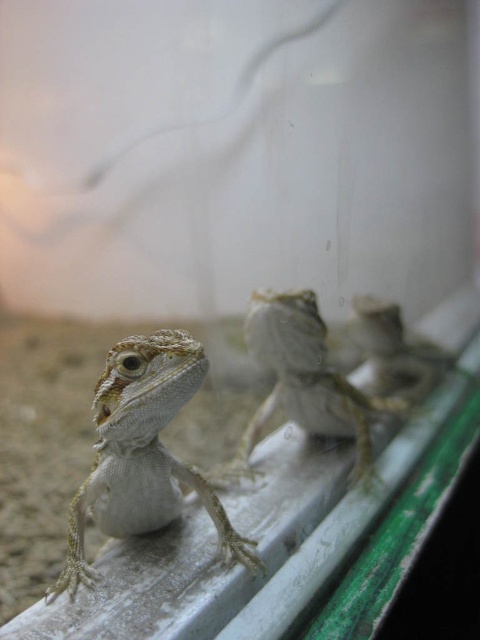
You are a reptile keeper who needs to place a new heating pad in the terrarium. The heating pad is designed to accommodate lizards up to the width of the smooth beige lizard at center. Can the heating pad also fit the white matte lizard at center?

The white matte lizard at center has a lesser width compared to smooth beige lizard at center, so yes, the heating pad designed for the smooth beige lizard at center can also accommodate the white matte lizard at center.